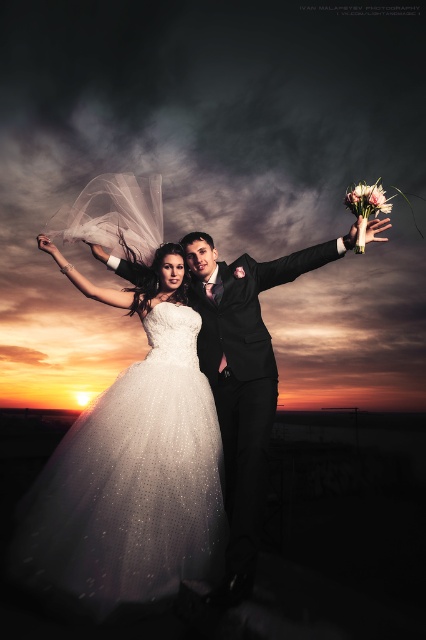
Between satin white gown at center and pink silk bouquet at upper right, which one has more height?

satin white gown at center

Who is positioned more to the left, satin white gown at center or pink silk bouquet at upper right?

satin white gown at center is more to the left.

The width and height of the screenshot is (426, 640). Identify the location of satin white gown at center. (131, 465).

Image resolution: width=426 pixels, height=640 pixels. Identify the location of shiny black suit at center. (242, 376).

Based on the photo, does shiny black suit at center have a lesser height compared to pink silk bouquet at upper right?

No.

Who is more forward, (268, 268) or (377, 184)?

Point (377, 184)

In order to click on shiny black suit at center in this screenshot , I will do `click(242, 376)`.

Is satin white gown at center below shiny black suit at center?

Indeed, satin white gown at center is positioned under shiny black suit at center.

Can you confirm if satin white gown at center is taller than shiny black suit at center?

No.

Locate an element on the screen. satin white gown at center is located at coordinates (131, 465).